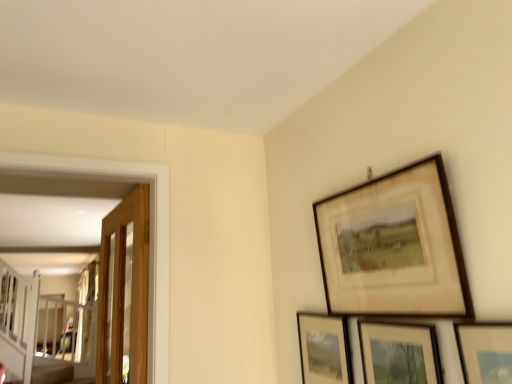
Question: Considering the relative sizes of matte black picture frame at lower right, the 4th picture frame positioned from the front, and wooden glass door at left in the image provided, is matte black picture frame at lower right, the 4th picture frame positioned from the front, smaller than wooden glass door at left?

Choices:
 (A) no
 (B) yes

Answer: (B)

Question: Is matte black picture frame at lower right, acting as the first picture frame starting from the back, turned away from wooden glass door at left?

Choices:
 (A) yes
 (B) no

Answer: (B)

Question: Is matte black picture frame at lower right, the 4th picture frame positioned from the front, closer to camera compared to wooden glass door at left?

Choices:
 (A) yes
 (B) no

Answer: (A)

Question: From a real-world perspective, is matte black picture frame at lower right, the 4th picture frame positioned from the front, on wooden glass door at left?

Choices:
 (A) yes
 (B) no

Answer: (B)

Question: Considering the relative sizes of matte black picture frame at lower right, acting as the first picture frame starting from the back, and wooden glass door at left in the image provided, is matte black picture frame at lower right, acting as the first picture frame starting from the back, taller than wooden glass door at left?

Choices:
 (A) no
 (B) yes

Answer: (A)

Question: Does point (128, 332) appear closer or farther from the camera than point (356, 294)?

Choices:
 (A) farther
 (B) closer

Answer: (A)

Question: Is wooden glass door at left inside or outside of wooden picture frame at upper right, which is counted as the second picture frame, starting from the front?

Choices:
 (A) inside
 (B) outside

Answer: (B)

Question: From a real-world perspective, is wooden glass door at left above or below wooden picture frame at upper right, the third picture frame when ordered from back to front?

Choices:
 (A) above
 (B) below

Answer: (B)

Question: Considering the relative positions of wooden glass door at left and wooden picture frame at upper right, the third picture frame when ordered from back to front, in the image provided, is wooden glass door at left to the left or to the right of wooden picture frame at upper right, the third picture frame when ordered from back to front,?

Choices:
 (A) left
 (B) right

Answer: (A)

Question: From the image's perspective, is wooden glass door at left located above or below matte black picture frame at lower right, acting as the first picture frame starting from the back?

Choices:
 (A) below
 (B) above

Answer: (B)

Question: Does point (138, 263) appear closer or farther from the camera than point (326, 362)?

Choices:
 (A) closer
 (B) farther

Answer: (B)

Question: Looking at the image, does wooden glass door at left seem bigger or smaller compared to matte black picture frame at lower right, the 4th picture frame positioned from the front?

Choices:
 (A) big
 (B) small

Answer: (A)

Question: Considering the relative positions of wooden glass door at left and matte black picture frame at lower right, the 4th picture frame positioned from the front, in the image provided, is wooden glass door at left to the left or to the right of matte black picture frame at lower right, the 4th picture frame positioned from the front,?

Choices:
 (A) left
 (B) right

Answer: (A)

Question: From a real-world perspective, is matte wooden picture frame at lower right, the first picture frame viewed from the front, above or below matte black picture frame at lower right, acting as the first picture frame starting from the back?

Choices:
 (A) below
 (B) above

Answer: (A)

Question: Based on their sizes in the image, would you say matte wooden picture frame at lower right, the 4th picture frame viewed from the back, is bigger or smaller than matte black picture frame at lower right, the 4th picture frame positioned from the front?

Choices:
 (A) small
 (B) big

Answer: (B)